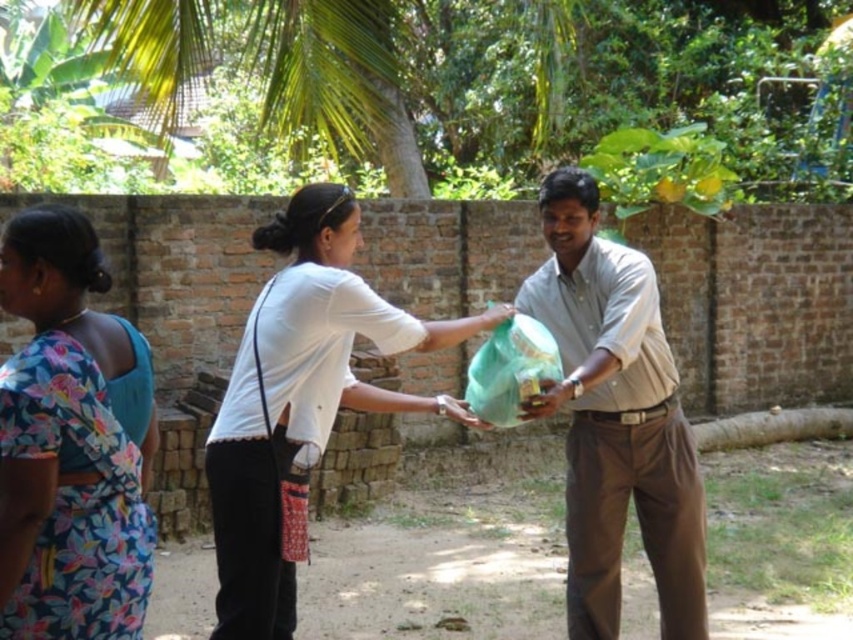
Is point (64, 371) less distant than point (573, 208)?

Yes.

Can you confirm if floral fabric saree at left is positioned to the right of matte green bag at center?

No, floral fabric saree at left is not to the right of matte green bag at center.

The width and height of the screenshot is (853, 640). Find the location of `floral fabric saree at left`. floral fabric saree at left is located at coordinates (67, 445).

Consider the image. Which is more to the right, floral fabric saree at left or white matte shirt at center?

Positioned to the right is white matte shirt at center.

Is floral fabric saree at left below white matte shirt at center?

No.

The image size is (853, 640). What do you see at coordinates (67, 445) in the screenshot? I see `floral fabric saree at left` at bounding box center [67, 445].

Identify the location of floral fabric saree at left. (67, 445).

Between white matte shirt at center and matte green bag at center, which one appears on the left side from the viewer's perspective?

white matte shirt at center

Is white matte shirt at center shorter than matte green bag at center?

Correct, white matte shirt at center is not as tall as matte green bag at center.

The width and height of the screenshot is (853, 640). Describe the element at coordinates (300, 403) in the screenshot. I see `white matte shirt at center` at that location.

Identify the location of white matte shirt at center. (300, 403).